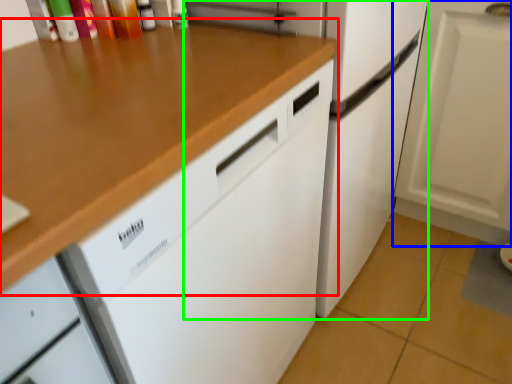
Question: Estimate the real-world distances between objects in this image. Which object is closer to countertop (highlighted by a red box), cabinetry (highlighted by a blue box) or refrigerator (highlighted by a green box)?

Choices:
 (A) cabinetry
 (B) refrigerator

Answer: (B)